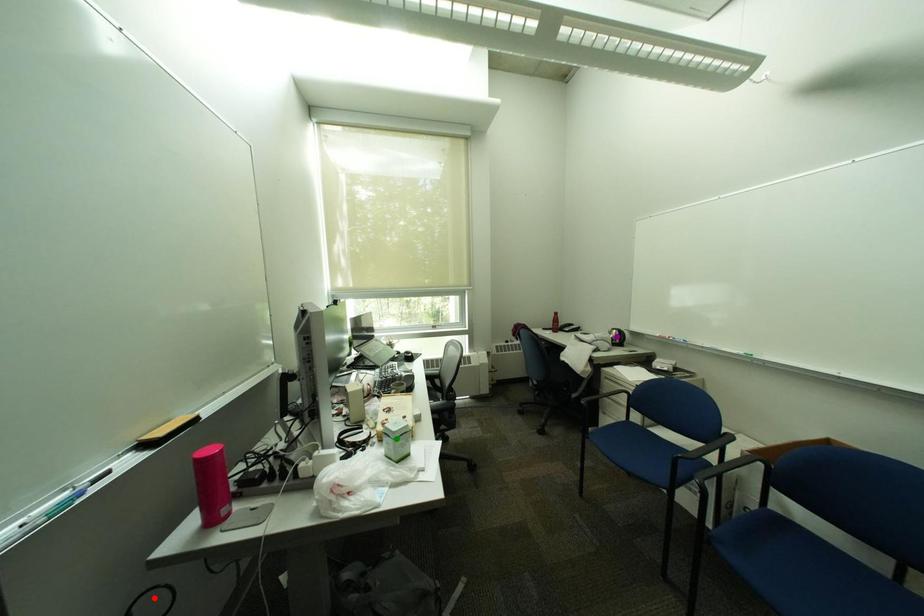
Order these from farthest to nearest:
purple point, red point, green point

purple point → green point → red point